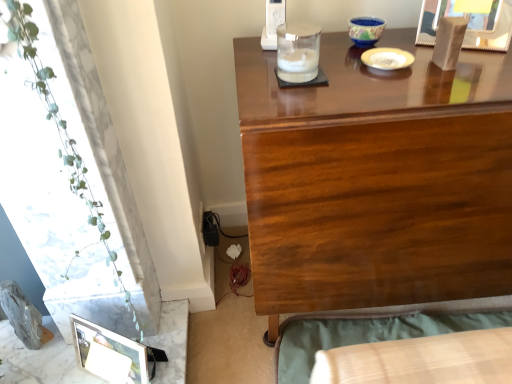
What do you see at coordinates (378, 329) in the screenshot? I see `wooden bed frame at lower right` at bounding box center [378, 329].

What do you see at coordinates (63, 139) in the screenshot? I see `green leafy plant at left` at bounding box center [63, 139].

The width and height of the screenshot is (512, 384). What do you see at coordinates (365, 30) in the screenshot?
I see `blue ceramic bowl at upper center, which appears as the second candle holder when viewed from the front` at bounding box center [365, 30].

The width and height of the screenshot is (512, 384). In order to click on wooden picture frame at upper right, the first picture frame positioned from the top in this screenshot , I will do `click(490, 28)`.

Describe the element at coordinates (298, 51) in the screenshot. I see `clear glass candle holder at upper center, arranged as the 1th candle holder when viewed from the front` at that location.

Find the location of `wooden bed frame at lower right`. wooden bed frame at lower right is located at coordinates (378, 329).

Is the position of white glossy plate at upper center less distant than that of glossy wood desk at upper center?

No, it is behind glossy wood desk at upper center.

Is white glossy plate at upper center bigger or smaller than glossy wood desk at upper center?

Clearly, white glossy plate at upper center is smaller in size than glossy wood desk at upper center.

From a real-world perspective, does white glossy plate at upper center sit lower than glossy wood desk at upper center?

Actually, white glossy plate at upper center is physically above glossy wood desk at upper center in the real world.

Considering the points (380, 66) and (322, 226), which point is in front, point (380, 66) or point (322, 226)?

Positioned in front is point (322, 226).

Based on the photo, relative to clear glass candle holder at upper center, the second candle holder positioned from the back, is blue ceramic bowl at upper center, which is the 2th candle holder from bottom to top, in front or behind?

blue ceramic bowl at upper center, which is the 2th candle holder from bottom to top, is behind clear glass candle holder at upper center, the second candle holder positioned from the back.

Looking at this image, can you confirm if blue ceramic bowl at upper center, the first candle holder in the back-to-front sequence, is taller than clear glass candle holder at upper center, the second candle holder positioned from the back?

No.

Is blue ceramic bowl at upper center, which is the 2th candle holder from bottom to top, bigger or smaller than clear glass candle holder at upper center, the 2th candle holder from the right?

In the image, blue ceramic bowl at upper center, which is the 2th candle holder from bottom to top, appears to be smaller than clear glass candle holder at upper center, the 2th candle holder from the right.

From a real-world perspective, which is physically above, blue ceramic bowl at upper center, which is the 2th candle holder from bottom to top, or clear glass candle holder at upper center, arranged as the 1th candle holder when viewed from the front?

clear glass candle holder at upper center, arranged as the 1th candle holder when viewed from the front, is physically above.

Is wooden bed frame at lower right facing towards clear glass candle holder at upper center, which is the first candle holder in bottom-to-top order?

No, wooden bed frame at lower right does not turn towards clear glass candle holder at upper center, which is the first candle holder in bottom-to-top order.

From the image's perspective, is wooden bed frame at lower right positioned above or below clear glass candle holder at upper center, arranged as the 1th candle holder when viewed from the front?

wooden bed frame at lower right is below clear glass candle holder at upper center, arranged as the 1th candle holder when viewed from the front.

Based on the photo, is clear glass candle holder at upper center, which is the first candle holder in bottom-to-top order, completely or partially inside wooden bed frame at lower right?

No, clear glass candle holder at upper center, which is the first candle holder in bottom-to-top order, is not inside wooden bed frame at lower right.

Who is bigger, wooden bed frame at lower right or clear glass candle holder at upper center, the 2th candle holder from the right?

wooden bed frame at lower right is bigger.

Is white glossy plate at upper center at the back of glossy wood desk at upper center?

No, white glossy plate at upper center is not at the back of glossy wood desk at upper center.

Which is less distant, (257, 175) or (371, 66)?

The point (257, 175) is closer.

From a real-world perspective, is glossy wood desk at upper center positioned over white glossy plate at upper center based on gravity?

No, from a real-world perspective, glossy wood desk at upper center is not above white glossy plate at upper center.

Which is more to the left, glossy wood desk at upper center or white glossy plate at upper center?

white glossy plate at upper center.

Does point (380, 28) appear closer or farther from the camera than point (389, 57)?

Clearly, point (380, 28) is more distant from the camera than point (389, 57).

Considering the sizes of blue ceramic bowl at upper center, which is the 2th candle holder from bottom to top, and white glossy plate at upper center in the image, is blue ceramic bowl at upper center, which is the 2th candle holder from bottom to top, wider or thinner than white glossy plate at upper center?

Considering their sizes, blue ceramic bowl at upper center, which is the 2th candle holder from bottom to top, looks slimmer than white glossy plate at upper center.

In the scene shown: Who is shorter, blue ceramic bowl at upper center, which ranks as the 2th candle holder in left-to-right order, or white glossy plate at upper center?

white glossy plate at upper center is shorter.

From a real-world perspective, who is located higher, blue ceramic bowl at upper center, which appears as the second candle holder when viewed from the front, or white glossy plate at upper center?

blue ceramic bowl at upper center, which appears as the second candle holder when viewed from the front, from a real-world perspective.

Is green leafy plant at left in front of or behind blue ceramic bowl at upper center, positioned as the first candle holder in right-to-left order, in the image?

green leafy plant at left is in front of blue ceramic bowl at upper center, positioned as the first candle holder in right-to-left order.

Are green leafy plant at left and blue ceramic bowl at upper center, which ranks as the 2th candle holder in left-to-right order, located far from each other?

No, there isn't a large distance between green leafy plant at left and blue ceramic bowl at upper center, which ranks as the 2th candle holder in left-to-right order.

Which object is positioned more to the right, green leafy plant at left or blue ceramic bowl at upper center, the first candle holder when ordered from top to bottom?

blue ceramic bowl at upper center, the first candle holder when ordered from top to bottom, is more to the right.

Is green leafy plant at left positioned with its back to blue ceramic bowl at upper center, which ranks as the 2th candle holder in left-to-right order?

green leafy plant at left is not turned away from blue ceramic bowl at upper center, which ranks as the 2th candle holder in left-to-right order.

Could you tell me if wooden bed frame at lower right is facing green leafy plant at left?

No, wooden bed frame at lower right is not turned towards green leafy plant at left.

Would you say wooden bed frame at lower right is outside green leafy plant at left?

Yes, wooden bed frame at lower right is not within green leafy plant at left.

From the image's perspective, is wooden bed frame at lower right above or below green leafy plant at left?

Based on their image positions, wooden bed frame at lower right is located beneath green leafy plant at left.

Considering the relative sizes of wooden bed frame at lower right and green leafy plant at left in the image provided, is wooden bed frame at lower right thinner than green leafy plant at left?

In fact, wooden bed frame at lower right might be wider than green leafy plant at left.

You are a GUI agent. You are given a task and a screenshot of the screen. Output one action in this format:
    pyautogui.click(x=<x>, y=<y>)
    Task: Click on the tableware that appears above the glossy wood desk at upper center (from the image's perspective)
    The height and width of the screenshot is (384, 512).
    Given the screenshot: What is the action you would take?
    pyautogui.click(x=387, y=58)

What are the coordinates of `candle holder above the blue ceramic bowl at upper center, the first candle holder when ordered from top to bottom (from a real-world perspective)` in the screenshot? It's located at 298,51.

From the image, which object appears to be nearer to clear glass candle holder at upper center, positioned as the first candle holder in left-to-right order, metallic silver picture frame at lower left, positioned as the second picture frame in top-to-bottom order, or wooden bed frame at lower right?

wooden bed frame at lower right is positioned closer to the anchor clear glass candle holder at upper center, positioned as the first candle holder in left-to-right order.

When comparing their distances from wooden bed frame at lower right, does metallic silver picture frame at lower left, positioned as the second picture frame in top-to-bottom order, or clear glass candle holder at upper center, positioned as the first candle holder in left-to-right order, seem further?

clear glass candle holder at upper center, positioned as the first candle holder in left-to-right order, is positioned further to the anchor wooden bed frame at lower right.

From the image, which object appears to be farther from glossy wood desk at upper center, blue ceramic bowl at upper center, which ranks as the 2th candle holder in left-to-right order, or wooden picture frame at upper right, arranged as the 2th picture frame when ordered from the bottom?

blue ceramic bowl at upper center, which ranks as the 2th candle holder in left-to-right order, is further to glossy wood desk at upper center.

From the image, which object appears to be farther from green leafy plant at left, blue ceramic bowl at upper center, which is the 2th candle holder from bottom to top, or clear glass candle holder at upper center, which is the first candle holder in bottom-to-top order?

Based on the image, blue ceramic bowl at upper center, which is the 2th candle holder from bottom to top, appears to be further to green leafy plant at left.

From the image, which object appears to be nearer to white glossy plate at upper center, green leafy plant at left or glossy wood desk at upper center?

glossy wood desk at upper center is positioned closer to the anchor white glossy plate at upper center.

When comparing their distances from blue ceramic bowl at upper center, the first candle holder when ordered from top to bottom, does wooden picture frame at upper right, arranged as the 2th picture frame when ordered from the bottom, or metallic silver picture frame at lower left, placed as the 1th picture frame when sorted from left to right, seem closer?

wooden picture frame at upper right, arranged as the 2th picture frame when ordered from the bottom.

Based on their spatial positions, is glossy wood desk at upper center or green leafy plant at left further from metallic silver picture frame at lower left, the first picture frame ordered from the bottom?

Based on the image, glossy wood desk at upper center appears to be further to metallic silver picture frame at lower left, the first picture frame ordered from the bottom.

From the image, which object appears to be nearer to clear glass candle holder at upper center, the 2th candle holder from the right, metallic silver picture frame at lower left, the first picture frame ordered from the bottom, or green leafy plant at left?

green leafy plant at left is closer to clear glass candle holder at upper center, the 2th candle holder from the right.

At what (x,y) coordinates should I click in order to perform the action: click on tableware between metallic silver picture frame at lower left, positioned as the second picture frame in right-to-left order, and glossy wood desk at upper center, in the horizontal direction. Please return your answer as a coordinate pair (x, y). The height and width of the screenshot is (384, 512). Looking at the image, I should click on (387, 58).

Image resolution: width=512 pixels, height=384 pixels. Identify the location of desk between wooden picture frame at upper right, the 2th picture frame positioned from the left, and wooden bed frame at lower right from top to bottom. (376, 179).

The width and height of the screenshot is (512, 384). Find the location of `plant between blue ceramic bowl at upper center, which ranks as the 2th candle holder in left-to-right order, and wooden bed frame at lower right in the up-down direction`. plant between blue ceramic bowl at upper center, which ranks as the 2th candle holder in left-to-right order, and wooden bed frame at lower right in the up-down direction is located at coordinates (63, 139).

I want to click on tableware between wooden picture frame at upper right, arranged as the 2th picture frame when ordered from the bottom, and glossy wood desk at upper center, in the vertical direction, so click(x=387, y=58).